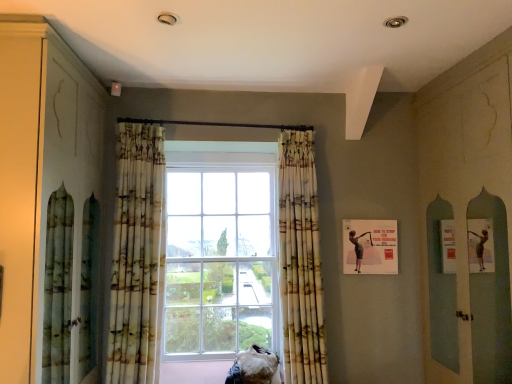
Question: Which direction should I rotate to look at printed fabric curtain at center, which is the 1th curtain from right to left?

Choices:
 (A) right
 (B) left

Answer: (A)

Question: Considering the relative positions of matte green cabinet at left and printed fabric curtain at center, which is the 1th curtain from right to left, in the image provided, is matte green cabinet at left to the left of printed fabric curtain at center, which is the 1th curtain from right to left, from the viewer's perspective?

Choices:
 (A) no
 (B) yes

Answer: (B)

Question: Is matte green cabinet at left closer to the viewer compared to printed fabric curtain at center, the second curtain in the left-to-right sequence?

Choices:
 (A) yes
 (B) no

Answer: (A)

Question: Is matte green cabinet at left taller than printed fabric curtain at center, the second curtain in the left-to-right sequence?

Choices:
 (A) yes
 (B) no

Answer: (A)

Question: Can you confirm if matte green cabinet at left is thinner than printed fabric curtain at center, which is the 1th curtain from right to left?

Choices:
 (A) no
 (B) yes

Answer: (A)

Question: Is matte green cabinet at left oriented away from printed fabric curtain at center, which is the 1th curtain from right to left?

Choices:
 (A) yes
 (B) no

Answer: (B)

Question: From a real-world perspective, is matte green cabinet at left over printed fabric curtain at center, the second curtain in the left-to-right sequence?

Choices:
 (A) yes
 (B) no

Answer: (A)

Question: Considering the relative sizes of matte paper poster at right and printed fabric curtain at center, marked as the first curtain in a left-to-right arrangement, in the image provided, is matte paper poster at right shorter than printed fabric curtain at center, marked as the first curtain in a left-to-right arrangement,?

Choices:
 (A) no
 (B) yes

Answer: (B)

Question: Does matte paper poster at right have a greater height compared to printed fabric curtain at center, which ranks as the 2th curtain in right-to-left order?

Choices:
 (A) no
 (B) yes

Answer: (A)

Question: Can printed fabric curtain at center, which ranks as the 2th curtain in right-to-left order, be found inside matte paper poster at right?

Choices:
 (A) no
 (B) yes

Answer: (A)

Question: Is matte paper poster at right outside of printed fabric curtain at center, marked as the first curtain in a left-to-right arrangement?

Choices:
 (A) yes
 (B) no

Answer: (A)

Question: Considering the relative sizes of matte paper poster at right and printed fabric curtain at center, which ranks as the 2th curtain in right-to-left order, in the image provided, is matte paper poster at right thinner than printed fabric curtain at center, which ranks as the 2th curtain in right-to-left order,?

Choices:
 (A) no
 (B) yes

Answer: (B)

Question: Does matte paper poster at right have a larger size compared to printed fabric curtain at center, which ranks as the 2th curtain in right-to-left order?

Choices:
 (A) no
 (B) yes

Answer: (A)

Question: From the image's perspective, is printed fabric curtain at center, which is the 1th curtain from right to left, located beneath matte paper poster at right?

Choices:
 (A) no
 (B) yes

Answer: (B)